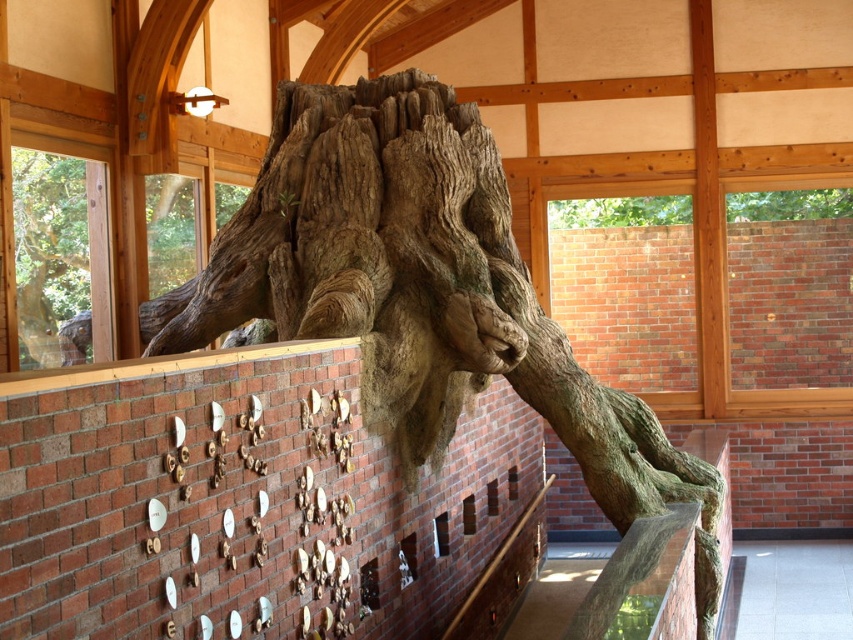
Which is below, brown rough tree trunk at left or brown rough bark at upper center?

brown rough tree trunk at left is below.

Does brown rough tree trunk at left have a lesser width compared to brown rough bark at upper center?

Incorrect, brown rough tree trunk at left's width is not less than brown rough bark at upper center's.

Is point (161, 232) behind point (583, 220)?

That is False.

Where is `brown rough tree trunk at left`? The image size is (853, 640). brown rough tree trunk at left is located at coordinates (55, 257).

Is natural wood tree trunk at center thinner than brown rough tree trunk at left?

Incorrect, natural wood tree trunk at center's width is not less than brown rough tree trunk at left's.

Which is in front, point (627, 500) or point (61, 296)?

Point (627, 500) is more forward.

Image resolution: width=853 pixels, height=640 pixels. Describe the element at coordinates (421, 292) in the screenshot. I see `natural wood tree trunk at center` at that location.

Locate an element on the screen. The width and height of the screenshot is (853, 640). natural wood tree trunk at center is located at coordinates (421, 292).

Is natural wood tree trunk at center below brown rough bark at upper center?

Yes.

Locate an element on the screen. natural wood tree trunk at center is located at coordinates (421, 292).

Identify the location of natural wood tree trunk at center. This screenshot has width=853, height=640. (421, 292).